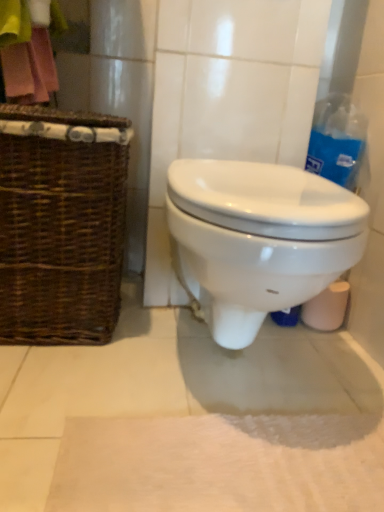
The width and height of the screenshot is (384, 512). I want to click on unoccupied space behind white soft bath mat at lower center, so click(233, 365).